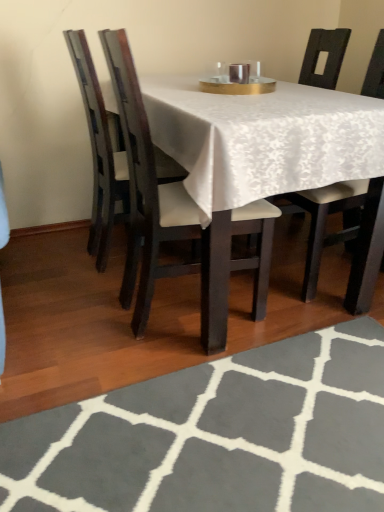
Question: Is gray woolen rug at lower center to the left of white fabric chair at center, the third chair positioned from the left, from the viewer's perspective?

Choices:
 (A) yes
 (B) no

Answer: (A)

Question: Is gray woolen rug at lower center to the right of white fabric chair at center, the third chair positioned from the left, from the viewer's perspective?

Choices:
 (A) no
 (B) yes

Answer: (A)

Question: Is gray woolen rug at lower center positioned in front of white fabric chair at center, the third chair positioned from the left?

Choices:
 (A) no
 (B) yes

Answer: (B)

Question: Is white fabric chair at center, which is counted as the first chair, starting from the right, inside gray woolen rug at lower center?

Choices:
 (A) yes
 (B) no

Answer: (B)

Question: Is the surface of gray woolen rug at lower center in direct contact with white fabric chair at center, the third chair positioned from the left?

Choices:
 (A) yes
 (B) no

Answer: (B)

Question: In terms of width, does matte black chair at left, arranged as the first chair when viewed from the left, look wider or thinner when compared to dark wood chair at center, which is the 2th chair in right-to-left order?

Choices:
 (A) wide
 (B) thin

Answer: (B)

Question: Is point (104, 162) closer or farther from the camera than point (193, 223)?

Choices:
 (A) farther
 (B) closer

Answer: (A)

Question: In the image, is matte black chair at left, arranged as the first chair when viewed from the left, positioned in front of or behind dark wood chair at center, which is the 2th chair in right-to-left order?

Choices:
 (A) behind
 (B) front

Answer: (A)

Question: From their relative heights in the image, would you say matte black chair at left, arranged as the first chair when viewed from the left, is taller or shorter than dark wood chair at center, which is the 2th chair in right-to-left order?

Choices:
 (A) short
 (B) tall

Answer: (A)

Question: In terms of size, does white fabric chair at center, which is counted as the first chair, starting from the right, appear bigger or smaller than dark wood chair at center, the second chair positioned from the left?

Choices:
 (A) small
 (B) big

Answer: (B)

Question: Relative to dark wood chair at center, the second chair positioned from the left, is white fabric chair at center, the third chair positioned from the left, in front or behind?

Choices:
 (A) front
 (B) behind

Answer: (B)

Question: Considering the positions of point (367, 81) and point (137, 100), is point (367, 81) closer or farther from the camera than point (137, 100)?

Choices:
 (A) farther
 (B) closer

Answer: (A)

Question: From the image's perspective, relative to dark wood chair at center, which is the 2th chair in right-to-left order, is white fabric chair at center, which is counted as the first chair, starting from the right, above or below?

Choices:
 (A) above
 (B) below

Answer: (A)

Question: Considering the positions of dark wood chair at center, the second chair positioned from the left, and matte black chair at left, positioned as the third chair in right-to-left order, in the image, is dark wood chair at center, the second chair positioned from the left, taller or shorter than matte black chair at left, positioned as the third chair in right-to-left order,?

Choices:
 (A) tall
 (B) short

Answer: (A)

Question: From a real-world perspective, is dark wood chair at center, the second chair positioned from the left, physically located above or below matte black chair at left, positioned as the third chair in right-to-left order?

Choices:
 (A) above
 (B) below

Answer: (A)